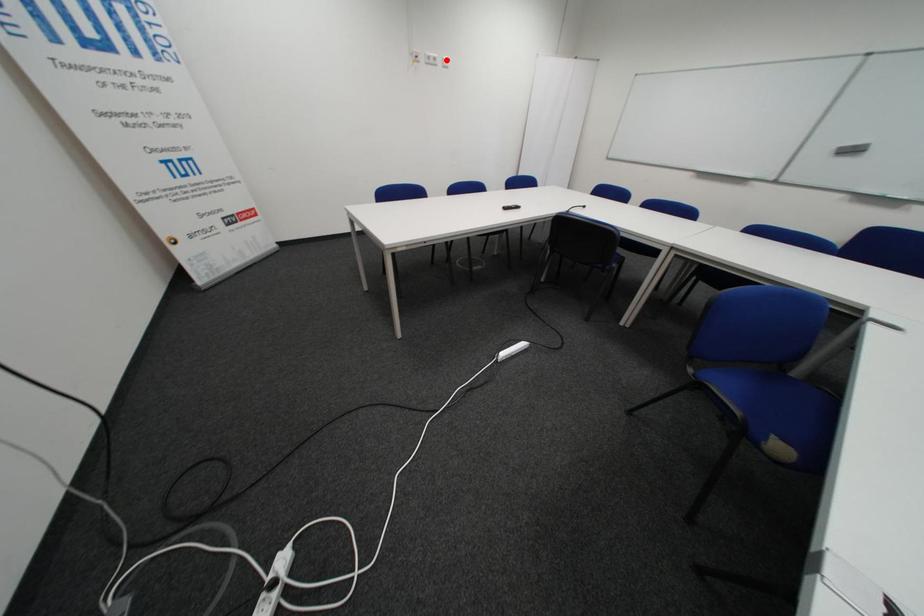
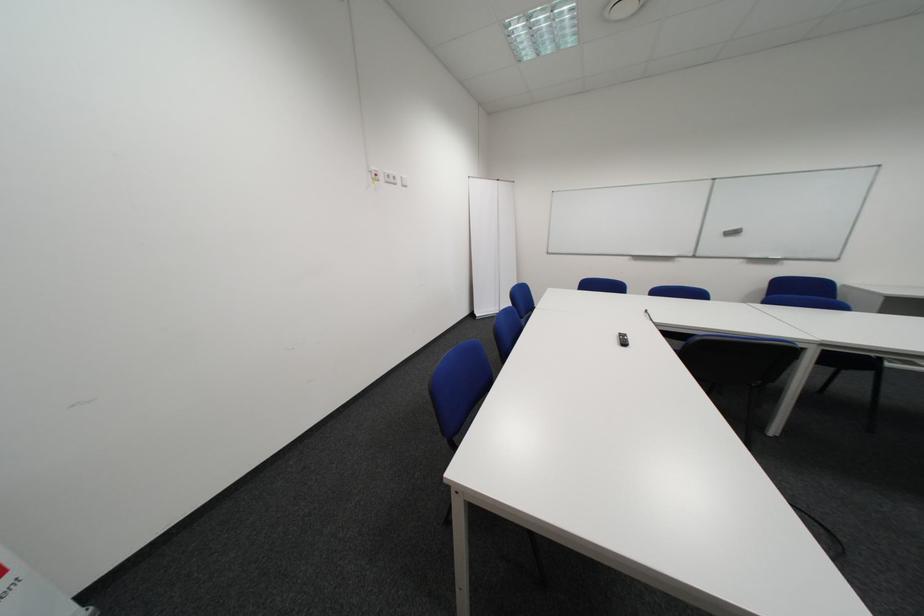
In the second image, find the point that corresponds to the highlighted location in the first image.

(407, 179)